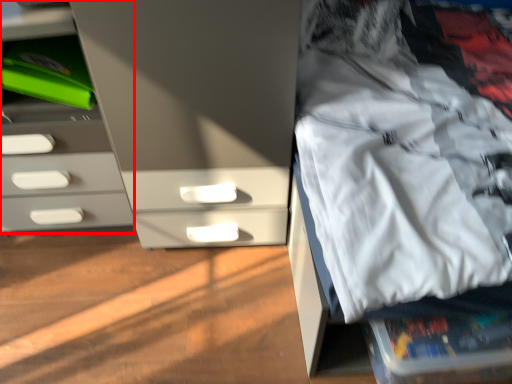
Question: In this image, where is chest of drawers (annotated by the red box) located relative to clothing?

Choices:
 (A) right
 (B) left

Answer: (B)